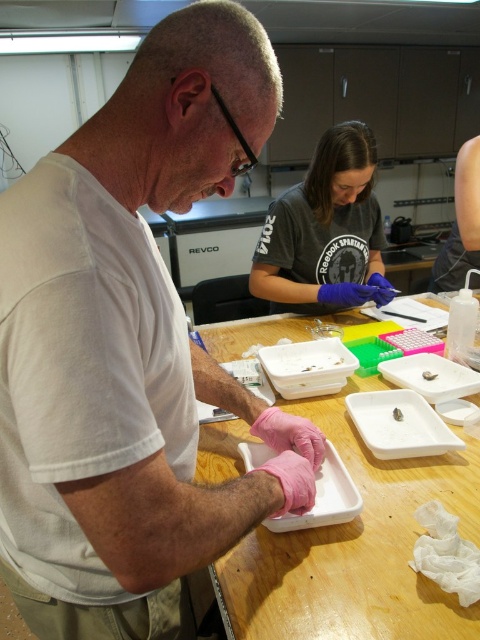
Question: Can you confirm if pink rubber gloves at left is positioned below white plastic tray at center?

Choices:
 (A) yes
 (B) no

Answer: (B)

Question: Which of these objects is positioned farthest from the dark gray t-shirt at center?

Choices:
 (A) pink rubber gloves at left
 (B) white plastic tray at center

Answer: (A)

Question: Is white plastic tray at center closer to camera compared to dark gray t-shirt at center?

Choices:
 (A) yes
 (B) no

Answer: (A)

Question: Which of the following is the farthest from the observer?

Choices:
 (A) pink rubber gloves at left
 (B) dark gray t-shirt at center

Answer: (B)

Question: Which point appears farthest from the camera in this image?

Choices:
 (A) (470, 440)
 (B) (34, 556)

Answer: (A)

Question: Observing the image, what is the correct spatial positioning of pink rubber gloves at left in reference to white plastic tray at center?

Choices:
 (A) right
 (B) left

Answer: (B)